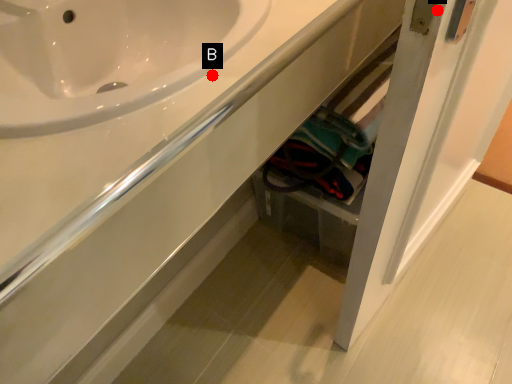
Question: Two points are circled on the image, labeled by A and B beside each circle. Which of the following is the closest to the observer?

Choices:
 (A) A is closer
 (B) B is closer

Answer: (A)